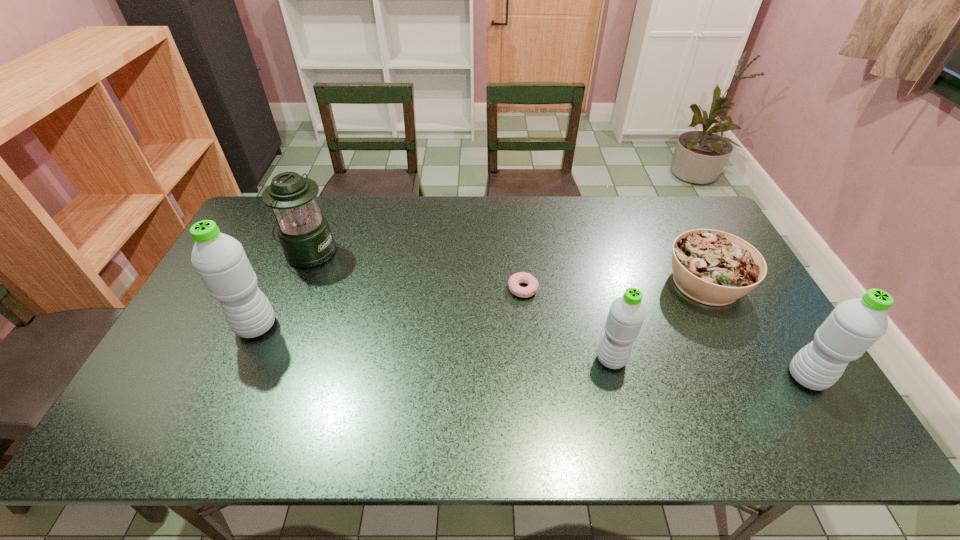
I want to click on blank area at the near edge, so click(x=519, y=394).

You are a GUI agent. You are given a task and a screenshot of the screen. Output one action in this format:
    pyautogui.click(x=<x>, y=<y>)
    Task: Click on the blank area at the left edge
    
    Given the screenshot: What is the action you would take?
    pyautogui.click(x=258, y=272)

In the image, there is a desktop. At what (x,y) coordinates should I click in order to perform the action: click on vacant region at the right edge. Please return your answer as a coordinate pair (x, y). The image size is (960, 540). Looking at the image, I should click on (725, 331).

Identify the location of vacant space at the far left corner. Image resolution: width=960 pixels, height=540 pixels. (266, 213).

Locate an element on the screen. This screenshot has width=960, height=540. vacant space at the far right corner of the desktop is located at coordinates (674, 220).

The width and height of the screenshot is (960, 540). I want to click on vacant space that is in between the shortest water bottle and the shortest object, so click(567, 325).

Find the location of a particular element. vacant region between the second tallest water bottle and the leftmost water bottle is located at coordinates (532, 352).

The width and height of the screenshot is (960, 540). Identify the location of vacant space that is in between the lantern and the farthest water bottle. (283, 289).

This screenshot has height=540, width=960. I want to click on vacant area between the third object from left to right and the lantern, so click(x=416, y=271).

Where is `vacant area between the second shortest water bottle and the salad`? This screenshot has width=960, height=540. vacant area between the second shortest water bottle and the salad is located at coordinates pos(756,330).